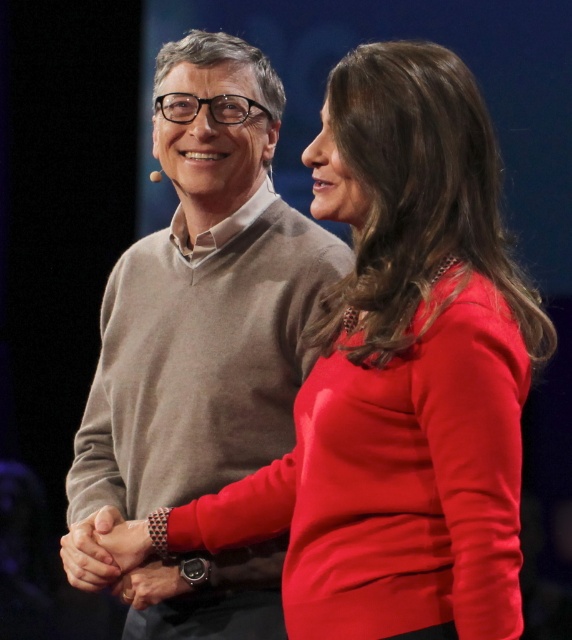
Looking at this image, you are an event planner organizing a photoshoot and need to place a decorative banner. The banner must be positioned at the exact center of the matte gray sweater at center. What are the coordinates where you should place the banner?

The coordinates for placing the banner at the exact center of the matte gray sweater at center are point [204,298].

You are a photographer taking a closeup shot of the two people in the image. You notice the matte gray sweater at center and the matte black hands at center. Which object is covering part of the other?

The matte gray sweater at center is positioned over matte black hands at center, so the sweater is covering part of the hands.